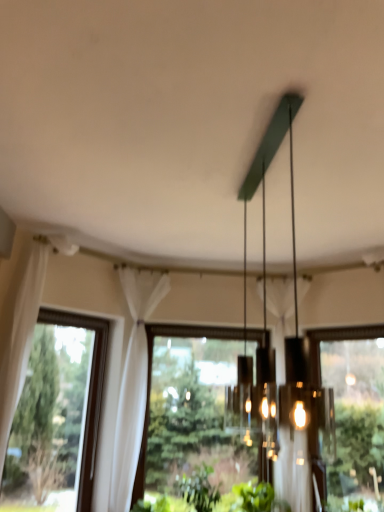
Question: From the image's perspective, would you say matte green chandelier at center is positioned over white sheer curtain at left?

Choices:
 (A) yes
 (B) no

Answer: (A)

Question: Can you see matte green chandelier at center touching white sheer curtain at left?

Choices:
 (A) no
 (B) yes

Answer: (A)

Question: From a real-world perspective, is matte green chandelier at center positioned over white sheer curtain at left based on gravity?

Choices:
 (A) yes
 (B) no

Answer: (A)

Question: Can you confirm if matte green chandelier at center is positioned to the right of white sheer curtain at left?

Choices:
 (A) no
 (B) yes

Answer: (B)

Question: Are matte green chandelier at center and white sheer curtain at left far apart?

Choices:
 (A) yes
 (B) no

Answer: (A)

Question: Is matte green chandelier at center thinner than white sheer curtain at left?

Choices:
 (A) no
 (B) yes

Answer: (B)

Question: From a real-world perspective, is green leafy plant at lower center over transparent glass window at right, which appears as the 3th window when viewed from the left?

Choices:
 (A) yes
 (B) no

Answer: (B)

Question: From a real-world perspective, is green leafy plant at lower center beneath transparent glass window at right, placed as the first window when sorted from right to left?

Choices:
 (A) yes
 (B) no

Answer: (A)

Question: Is green leafy plant at lower center thinner than transparent glass window at right, placed as the first window when sorted from right to left?

Choices:
 (A) no
 (B) yes

Answer: (A)

Question: Would you say transparent glass window at right, which appears as the 3th window when viewed from the left, is part of green leafy plant at lower center's contents?

Choices:
 (A) yes
 (B) no

Answer: (B)

Question: Does green leafy plant at lower center appear on the left side of transparent glass window at right, placed as the first window when sorted from right to left?

Choices:
 (A) no
 (B) yes

Answer: (B)

Question: Can you confirm if green leafy plant at lower center is bigger than transparent glass window at right, placed as the first window when sorted from right to left?

Choices:
 (A) yes
 (B) no

Answer: (B)

Question: From the image's perspective, is green leafy plant at lower center above transparent glass window at center, positioned as the second window in right-to-left order?

Choices:
 (A) yes
 (B) no

Answer: (B)